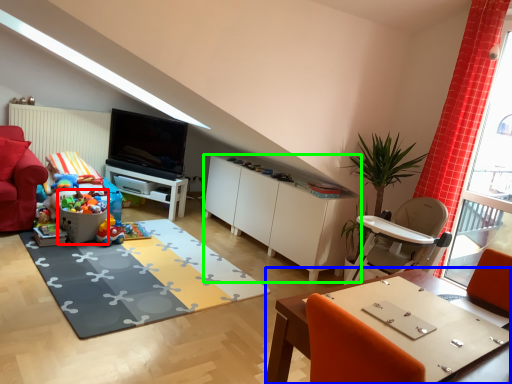
Question: Estimate the real-world distances between objects in this image. Which object is closer to toy (highlighted by a red box), table (highlighted by a blue box) or cabinetry (highlighted by a green box)?

Choices:
 (A) table
 (B) cabinetry

Answer: (B)